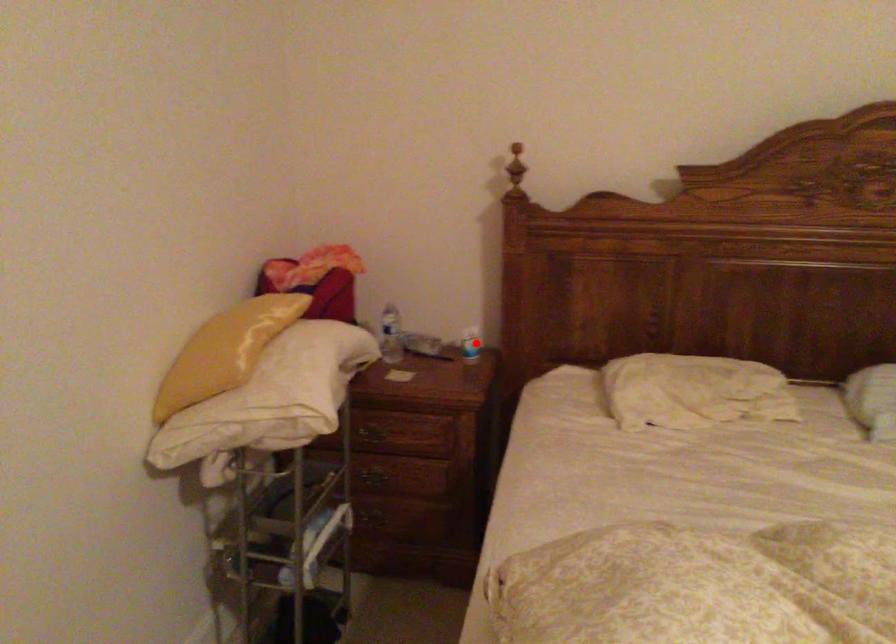
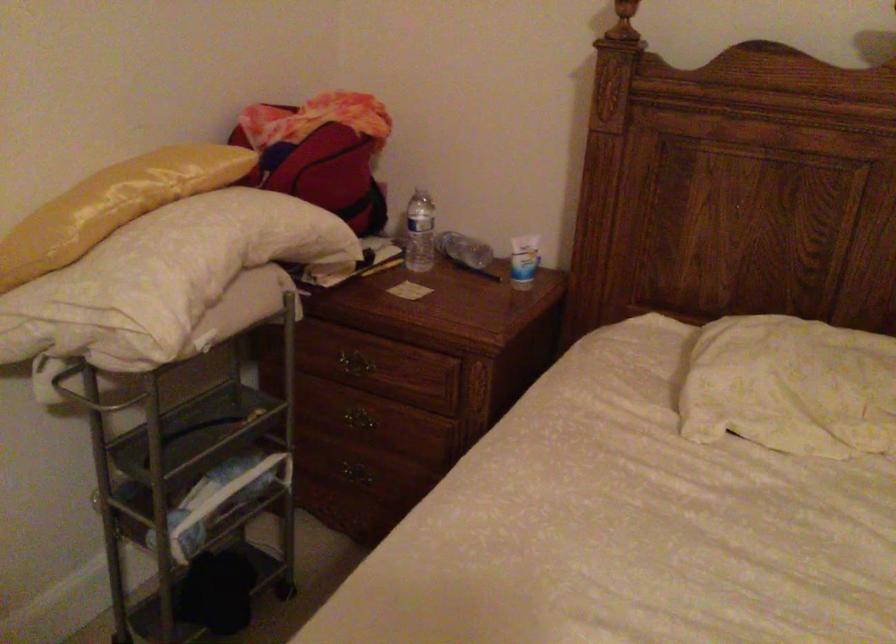
The point at the highlighted location is marked in the first image. Where is the corresponding point in the second image?

(523, 261)